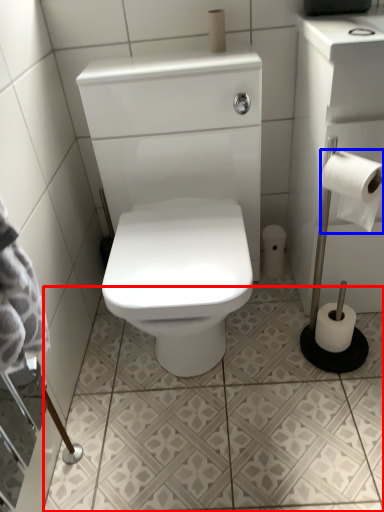
Question: Which point is further to the camera, ceramic tile (highlighted by a red box) or toilet paper (highlighted by a blue box)?

Choices:
 (A) ceramic tile
 (B) toilet paper

Answer: (A)